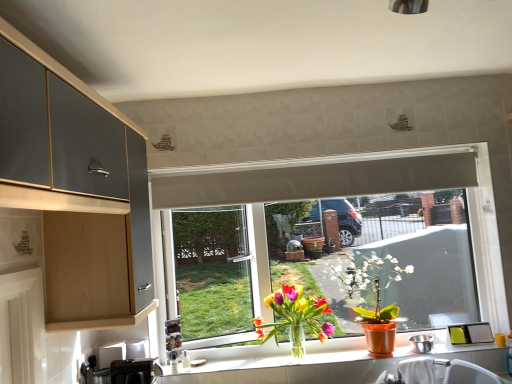
The image size is (512, 384). I want to click on vacant space to the left of metallic stainless steel bowl at window, which appears as the second appliance when viewed from the left, so click(396, 355).